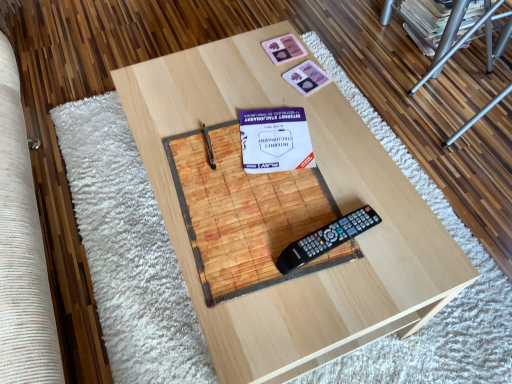
Locate an element on the screen. The height and width of the screenshot is (384, 512). vacant area that is in front of pink matte coaster at upper center, placed as the 2th square when sorted from bottom to top is located at coordinates (280, 94).